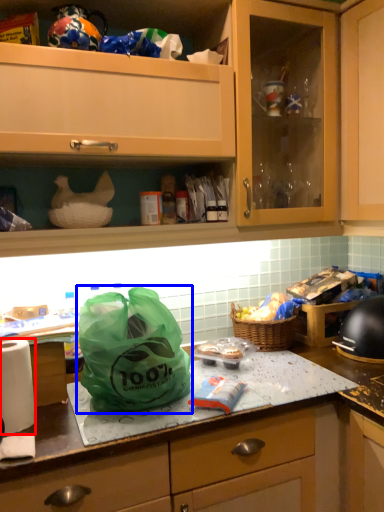
Question: Which point is closer to the camera, kitchen appliance (highlighted by a red box) or plastic bag (highlighted by a blue box)?

Choices:
 (A) kitchen appliance
 (B) plastic bag

Answer: (B)